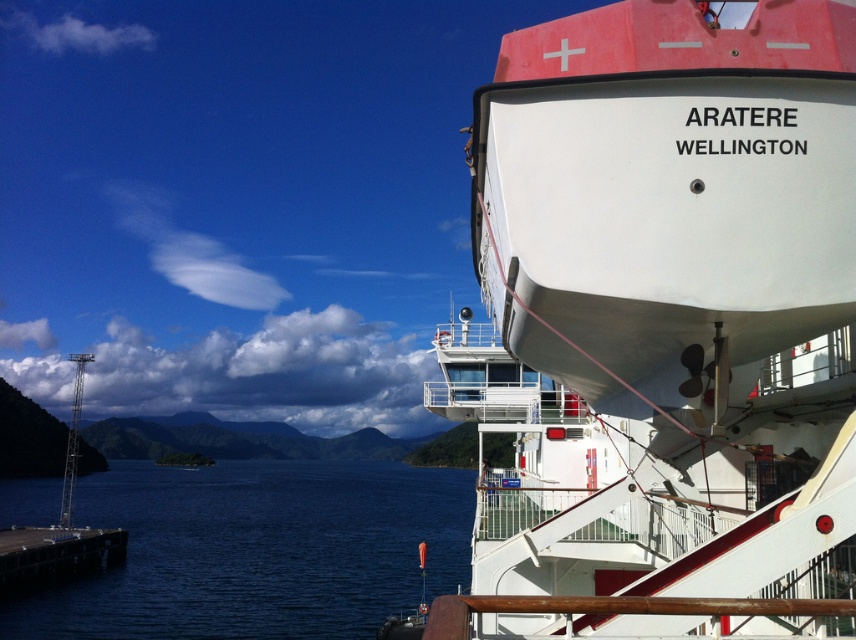
You are an observer standing on the dock looking out at the waterfront scene. You notice the white matte ship at upper right and the blue water at lower left. Which object appears smaller in the image?

The white matte ship at upper right appears smaller than the blue water at lower left in the image.

You are standing on the ferry Aratere Wellington and want to take a photo. You notice two points marked in the image. Which point, point [495,99] or point [200,508], is closer to you?

Point [495,99] is closer to the viewer than point [200,508].

You are standing on the dock and want to take a photo of the white matte ship at upper right. If your camera has a maximum focus range of 4 meters, will it be able to capture the ship clearly?

The white matte ship at upper right and the camera are 4.44 meters apart, which exceeds the camera maximum focus range of 4 meters. Therefore, the camera cannot capture the ship clearly.